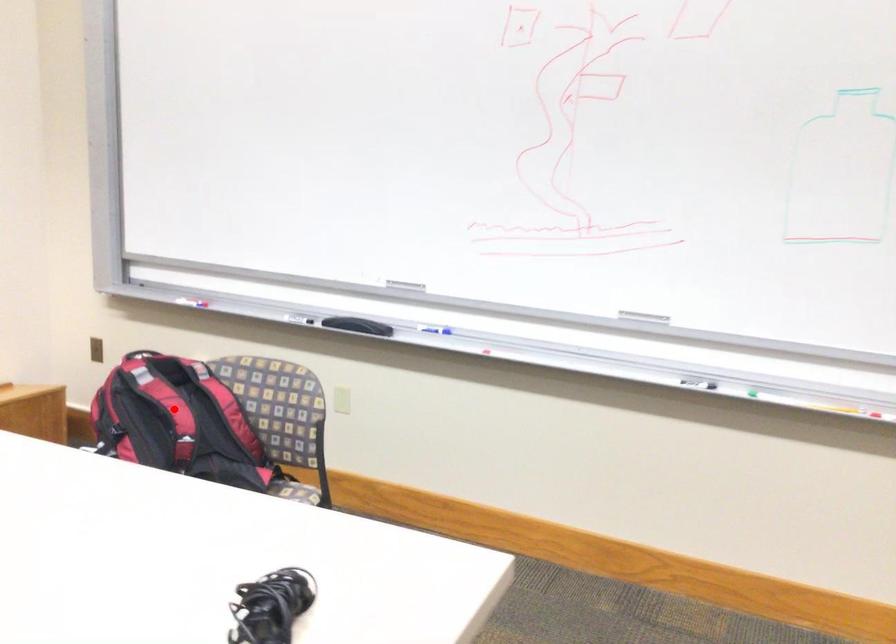
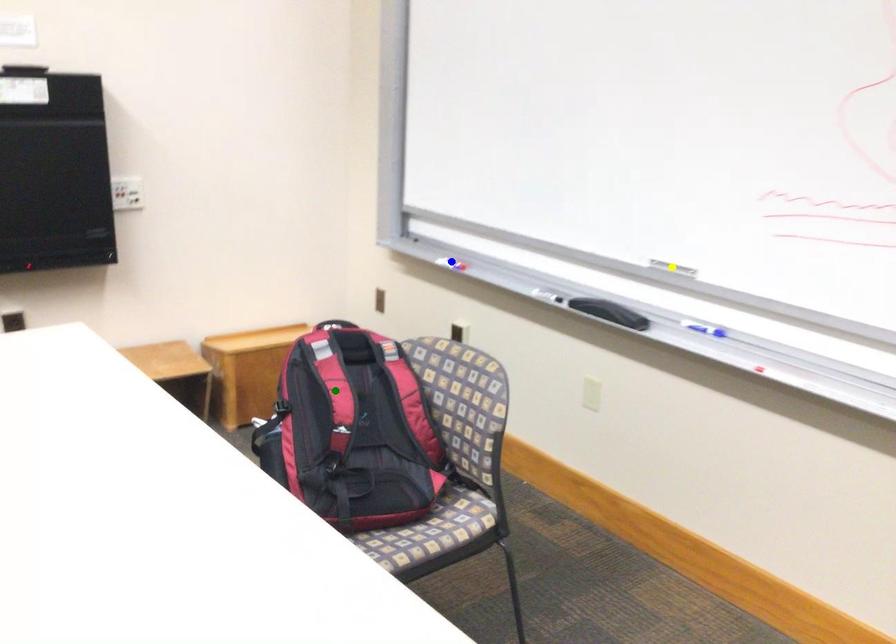
Question: I am providing you with two images of the same scene from different viewpoints. A red point is marked on the first image. You are given multiple points on the second image. Which mark in image 2 goes with the point in image 1?

Choices:
 (A) green point
 (B) blue point
 (C) yellow point

Answer: (A)